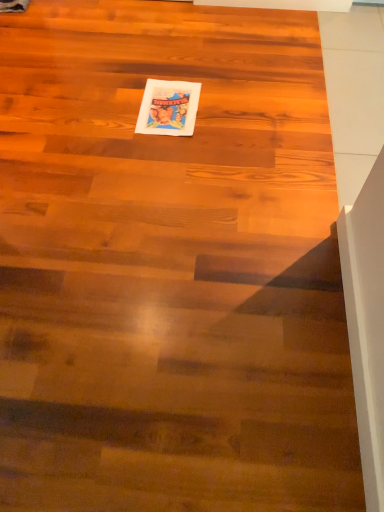
What are the coordinates of `vacant space underneath white paper book at center (from a real-world perspective)` in the screenshot? It's located at (168, 106).